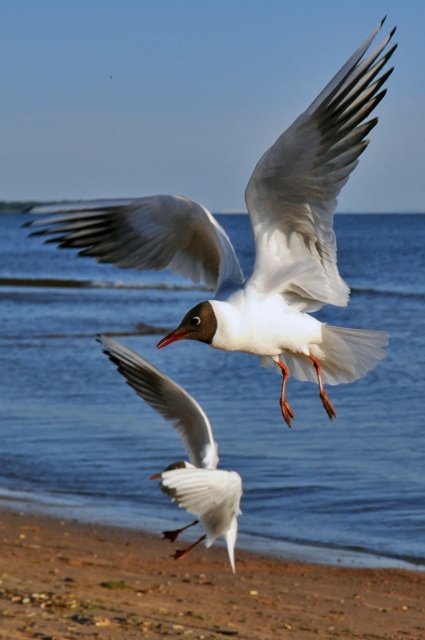
Question: Which point is closer to the camera?

Choices:
 (A) (249, 413)
 (B) (212, 284)

Answer: (B)

Question: Which is nearer to the white glossy seagull at center?

Choices:
 (A) white matte wing at upper center
 (B) white matte bird at center
 (C) brown sandy beach at lower center

Answer: (A)

Question: Which object is closer to the camera taking this photo?

Choices:
 (A) white feathered wing at upper center
 (B) white glossy seagull at center
 (C) blue water at center

Answer: (B)

Question: Can you confirm if blue water at center is positioned above white matte bird at center?

Choices:
 (A) no
 (B) yes

Answer: (B)

Question: Is blue water at center positioned before white matte bird at center?

Choices:
 (A) no
 (B) yes

Answer: (A)

Question: Can you confirm if white matte wing at upper center is smaller than white matte bird at center?

Choices:
 (A) no
 (B) yes

Answer: (B)